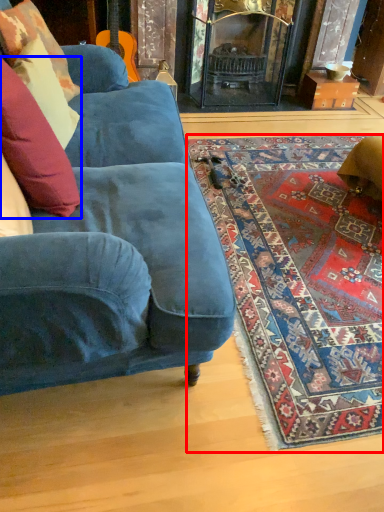
Question: Among these objects, which one is nearest to the camera, mat (highlighted by a red box) or pillow (highlighted by a blue box)?

Choices:
 (A) mat
 (B) pillow

Answer: (B)